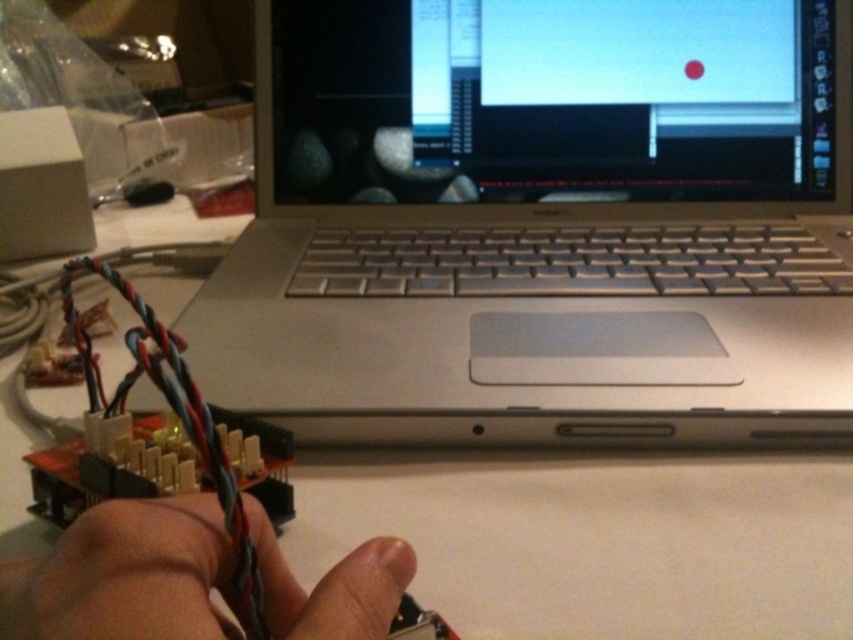
Question: Which point is closer to the camera?

Choices:
 (A) silver metallic laptop at center
 (B) skinny wire at lower left

Answer: (B)

Question: Is silver metallic laptop at center to the right of skinny wire at lower left from the viewer's perspective?

Choices:
 (A) no
 (B) yes

Answer: (B)

Question: Does silver metallic laptop at center have a lesser width compared to skinny wire at lower left?

Choices:
 (A) no
 (B) yes

Answer: (A)

Question: Which of the following is the farthest from the observer?

Choices:
 (A) (653, 166)
 (B) (218, 616)

Answer: (A)

Question: Is silver metallic laptop at center to the right of skinny wire at lower left from the viewer's perspective?

Choices:
 (A) no
 (B) yes

Answer: (B)